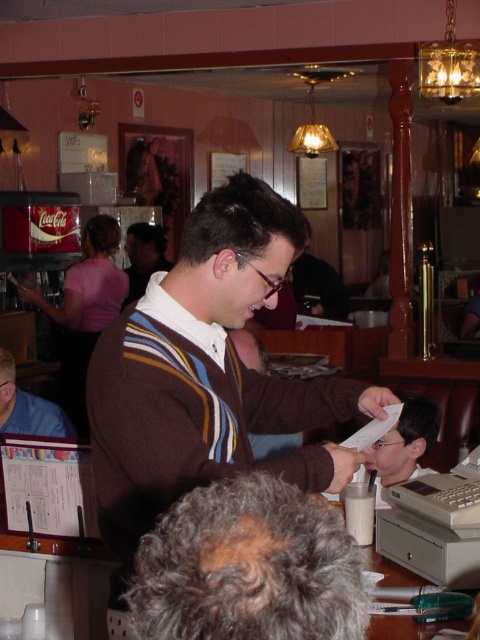
From the picture: You are a customer at the diner and want to place your soda can on the counter. You have a soda can that is 3 inches in diameter. The counter space between the matte black soda machine at left and the brown sweater at center is 12 inches. Can you safely place your soda can there without it tipping over?

The counter space between the matte black soda machine at left and the brown sweater at center is 12 inches. Since the soda can is only 3 inches in diameter, there is enough space to place it safely without tipping over.

You are standing at the entrance of the diner and want to grab a soda quickly. The matte black soda machine at left is your target. Considering the distance, can you reach it within 3 steps if each step you take is about 1 meter long?

The matte black soda machine at left is 4.36 meters away from camera. Since each step is about 1 meter, you would need at least 5 steps to reach it, so it would take more than 3 steps.

You are a customer at the diner and want to place your soda can on the counter. The soda can is 10 cm in diameter. The matte black soda machine at left and the brown sweater at center are both on the counter. Which object can the soda can fit next to without overlapping?

The soda can with a 10 cm diameter can fit next to the brown sweater at center because the matte black soda machine at left is larger in size and may not leave enough space.